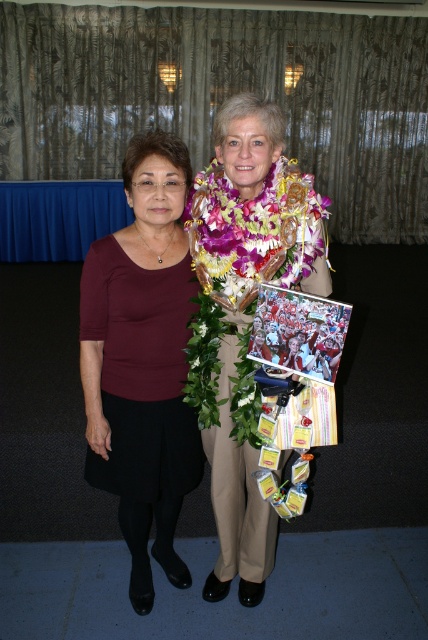
You are a photographer at a formal event. You need to capture a photo where the matte brown blouse at left and the maroon fabric blouse at left are both visible. Which blouse should you focus on to ensure both are in frame without cropping?

The matte brown blouse at left is taller than the maroon fabric blouse at left, so focusing on the taller matte brown blouse at left will ensure both are visible without cropping.

You are standing in front of two women at an event. You notice the matte brown blouse at left and the maroon fabric blouse at left. Which blouse is positioned closer to you?

The matte brown blouse at left is closer to the viewer than the maroon fabric blouse at left.